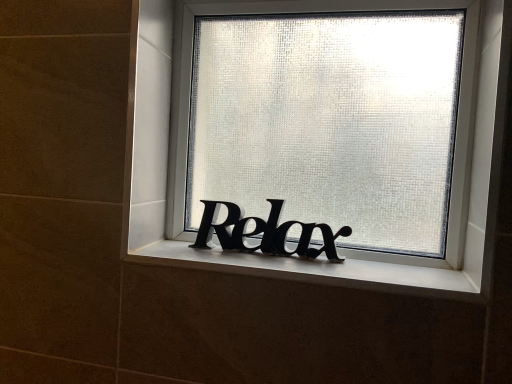
The image size is (512, 384). What do you see at coordinates (325, 269) in the screenshot?
I see `white smooth window sill at center` at bounding box center [325, 269].

What is the approximate height of white smooth window sill at center?

white smooth window sill at center is 1.30 inches tall.

Image resolution: width=512 pixels, height=384 pixels. I want to click on white smooth window sill at center, so click(325, 269).

This screenshot has height=384, width=512. What are the coordinates of `white smooth window sill at center` in the screenshot? It's located at (325, 269).